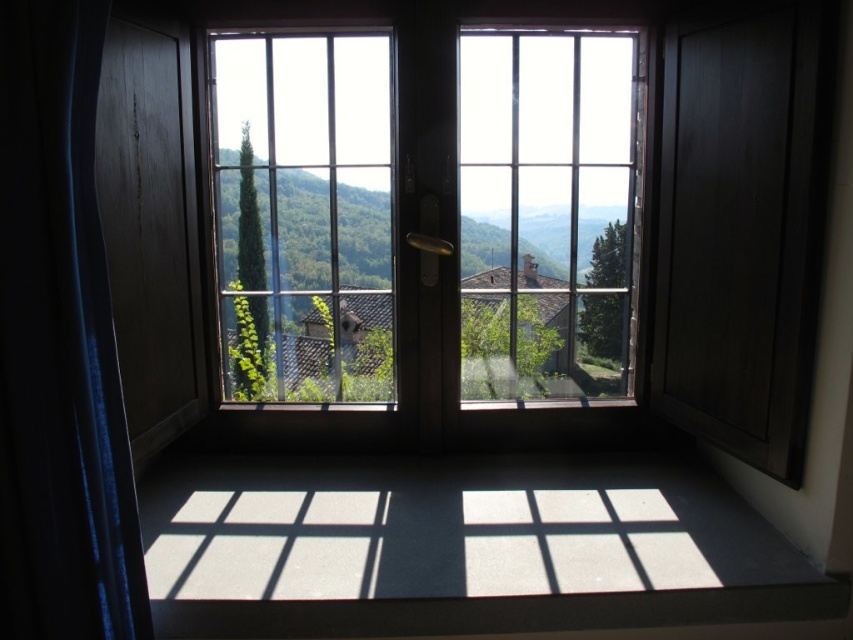
Identify the location of clear glass window at center. (430, 212).

Which of these two, clear glass window at center or blue fabric curtain at left, stands shorter?

clear glass window at center

Who is more distant from viewer, (518, 280) or (132, 620)?

Positioned behind is point (518, 280).

Where is `clear glass window at center`? Image resolution: width=853 pixels, height=640 pixels. clear glass window at center is located at coordinates (430, 212).